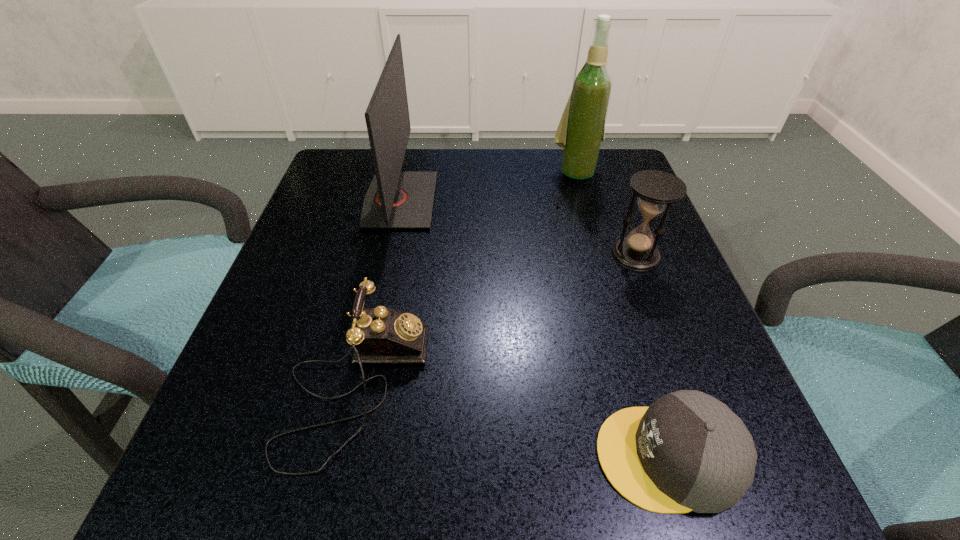
You are a GUI agent. You are given a task and a screenshot of the screen. Output one action in this format:
    pyautogui.click(x=<x>, y=<y>)
    Task: Click on the vacant region at the near left corner of the desktop
    
    Given the screenshot: What is the action you would take?
    pyautogui.click(x=254, y=502)

Locate an element on the screen. The height and width of the screenshot is (540, 960). vacant area at the far right corner is located at coordinates (563, 156).

Identify the location of free space between the second tallest object and the fourth tallest object. The image size is (960, 540). (377, 294).

You are a GUI agent. You are given a task and a screenshot of the screen. Output one action in this format:
    pyautogui.click(x=<x>, y=<y>)
    Task: Click on the free spot between the second tallest object and the tallest object
    
    Given the screenshot: What is the action you would take?
    pyautogui.click(x=488, y=186)

Find the location of a particular element. The height and width of the screenshot is (540, 960). free spot between the telephone and the tallest object is located at coordinates (466, 280).

The width and height of the screenshot is (960, 540). I want to click on vacant region between the second tallest object and the shortest object, so click(x=534, y=328).

Find the location of a particular element. Image resolution: width=960 pixels, height=540 pixels. vacant point located between the hourglass and the second tallest object is located at coordinates (517, 228).

This screenshot has width=960, height=540. Identify the location of free area in between the monitor and the cap. (534, 328).

This screenshot has height=540, width=960. Identify the location of unoccupied area between the monitor and the third tallest object. (517, 228).

Image resolution: width=960 pixels, height=540 pixels. Identify the location of vacant area that lies between the third shortest object and the second shortest object. (495, 321).